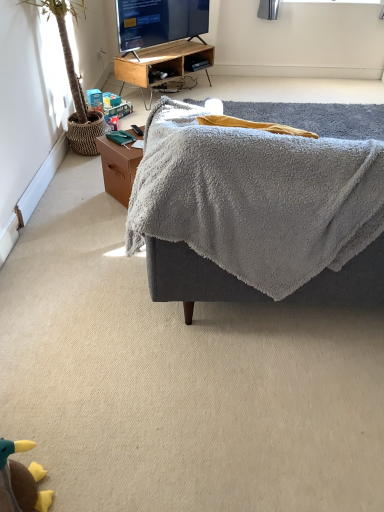
Identify the location of free location in front of gray fuzzy ottoman at center. (247, 414).